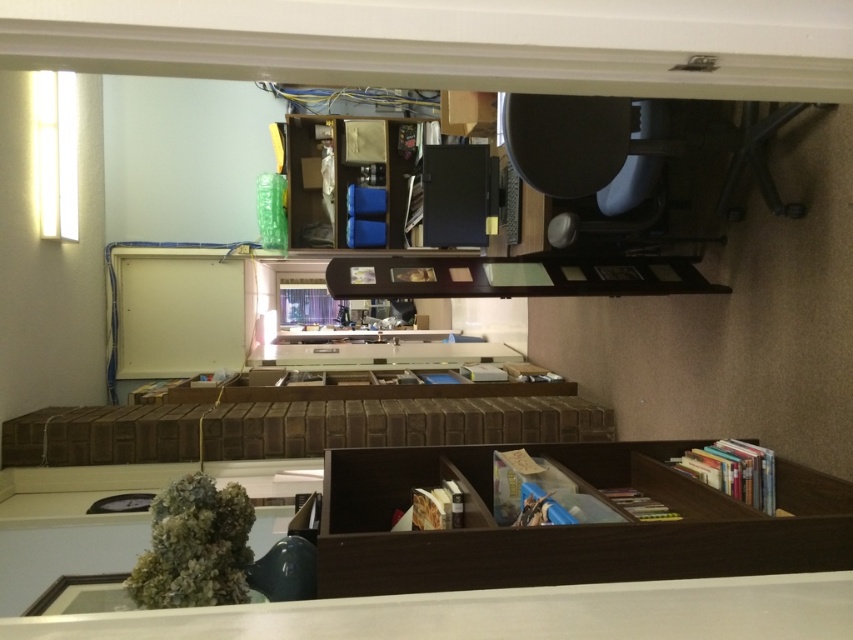
You are moving a 3.5 meter long ladder through the room and need to navigate between the brown wood bookshelf at center and the wooden bookshelf at upper center. Can the ladder fit through the space between them?

The distance between the brown wood bookshelf at center and the wooden bookshelf at upper center is 3.00 meters. Since the ladder is 3.5 meters long, it cannot fit through the space between them as the gap is shorter than the ladder.